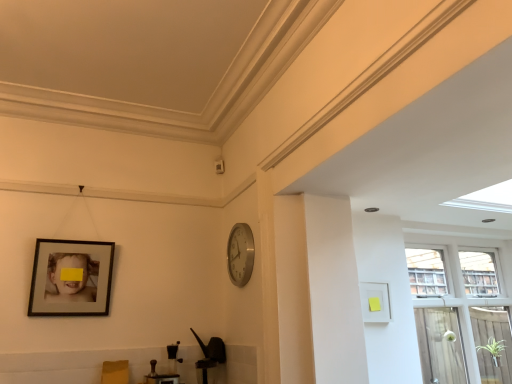
Question: Visually, is matte black picture frame at left, which is the second picture frame in right-to-left order, positioned to the left or to the right of clear glass screen door at right?

Choices:
 (A) left
 (B) right

Answer: (A)

Question: From the image's perspective, is matte black picture frame at left, which is the second picture frame in right-to-left order, above or below clear glass screen door at right?

Choices:
 (A) below
 (B) above

Answer: (B)

Question: Which object is the farthest from the silver metallic clock at center-right?

Choices:
 (A) clear glass screen door at right
 (B) transparent glass window at right
 (C) matte black picture frame at left, which is the second picture frame in right-to-left order
 (D) white matte picture frame at right, which appears as the 2th picture frame when viewed from the left

Answer: (A)

Question: Estimate the real-world distances between objects in this image. Which object is farther from the silver metallic clock at center-right?

Choices:
 (A) transparent glass window at right
 (B) matte black picture frame at left, the 1th picture frame when ordered from left to right
 (C) white matte picture frame at right, the first picture frame viewed from the right
 (D) clear glass screen door at right

Answer: (D)